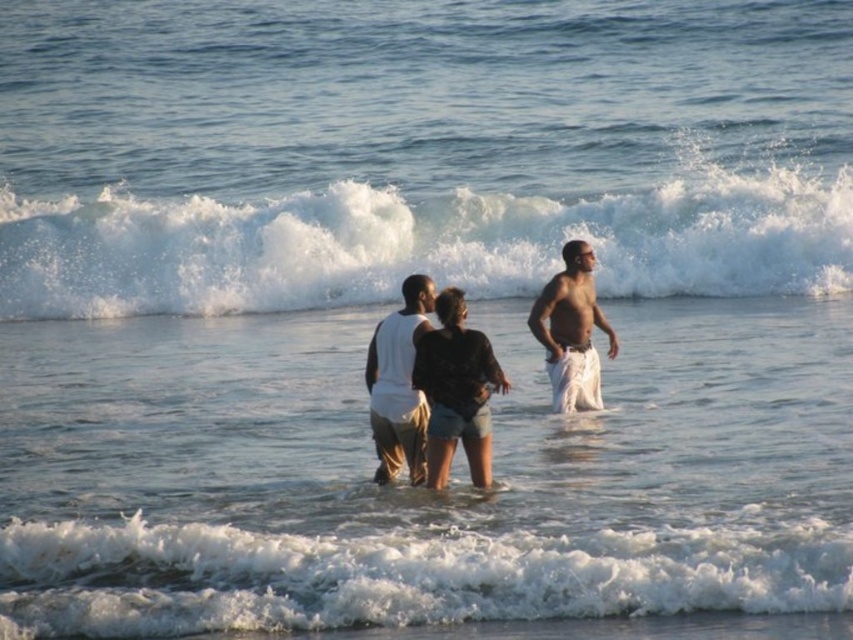
Question: Among these points, which one is farthest from the camera?

Choices:
 (A) click(393, 458)
 (B) click(235, 212)

Answer: (B)

Question: Which point is closer to the camera?

Choices:
 (A) (567, 376)
 (B) (445, 476)
 (C) (422, 417)
 (D) (386, 240)

Answer: (B)

Question: Which point appears closest to the camera in this image?

Choices:
 (A) (392, 413)
 (B) (6, 248)
 (C) (457, 300)

Answer: (C)

Question: Can you confirm if white frothy wave at upper center is positioned to the left of dark gray denim shorts at center?

Choices:
 (A) no
 (B) yes

Answer: (B)

Question: In this image, where is white frothy wave at upper center located relative to white frothy wave at lower center?

Choices:
 (A) left
 (B) right

Answer: (A)

Question: Does white frothy wave at upper center appear under white cotton shorts at right?

Choices:
 (A) yes
 (B) no

Answer: (B)